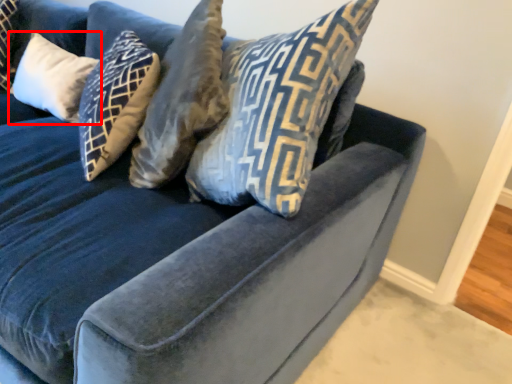
Question: From the image's perspective, what is the correct spatial relationship of pillow (annotated by the red box) in relation to pillow?

Choices:
 (A) above
 (B) below

Answer: (A)